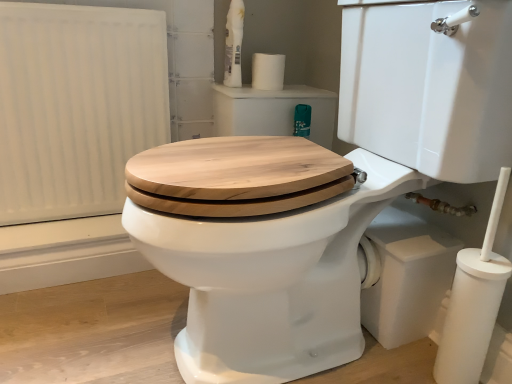
You are a GUI agent. You are given a task and a screenshot of the screen. Output one action in this format:
    pyautogui.click(x=<x>, y=<y>)
    Task: Click on the spots to the right of white matte toilet paper at upper center
    
    Given the screenshot: What is the action you would take?
    pyautogui.click(x=303, y=87)